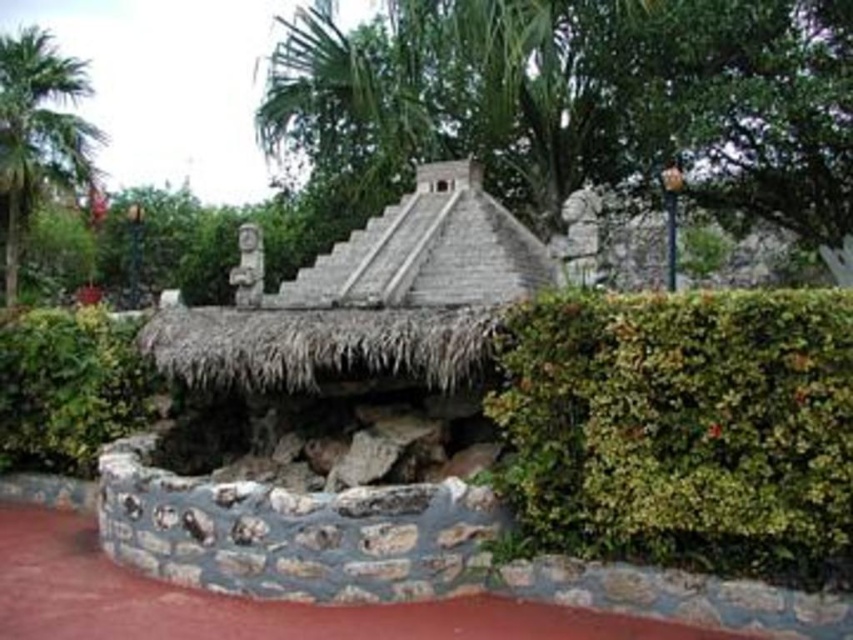
Question: Can you confirm if green leafy hedge at left is bigger than green leafy palm tree at left?

Choices:
 (A) yes
 (B) no

Answer: (B)

Question: Based on their relative distances, which object is farther from the green leafy hedge at right?

Choices:
 (A) green leafy tree at center
 (B) green leafy hedge at left

Answer: (A)

Question: Considering the real-world distances, which object is closest to the green leafy hedge at left?

Choices:
 (A) green leafy palm tree at left
 (B) green leafy tree at center

Answer: (B)

Question: Observing the image, what is the correct spatial positioning of green leafy hedge at left in reference to green leafy palm tree at left?

Choices:
 (A) right
 (B) left

Answer: (A)

Question: Can you confirm if green leafy tree at center is positioned to the right of green leafy palm tree at left?

Choices:
 (A) yes
 (B) no

Answer: (A)

Question: Estimate the real-world distances between objects in this image. Which object is closer to the green leafy tree at center?

Choices:
 (A) green leafy palm tree at left
 (B) green leafy hedge at left
 (C) green leafy hedge at right

Answer: (C)